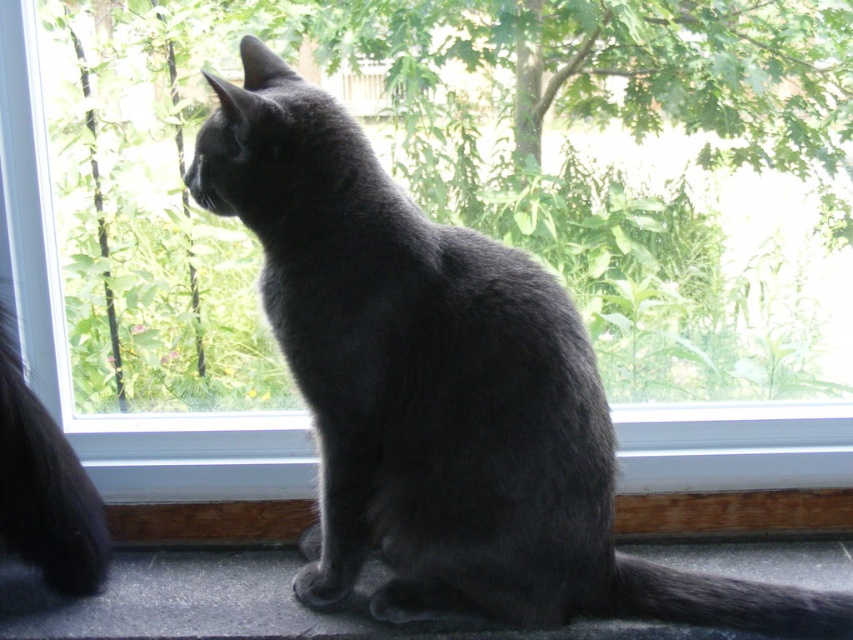
From the picture: You are a photographer positioned at the center of the room. You want to capture a photo of the matte gray cat at lower center through the window. Based on the cat s position, which direction should you move to get a better shot?

The matte gray cat at lower center is located at point [242,604], which means it is positioned near the bottom right corner of the frame. To center the cat in your photo, you should move to your left and slightly forward to adjust the angle so the cat is framed more centrally in the window view.

You are a photographer trying to capture both the shiny black cat at center and the matte gray cat at lower center in a single shot. Which cat will appear larger in the photo due to its position?

The shiny black cat at center will appear larger in the photo because it is closer to the viewer than the matte gray cat at lower center.